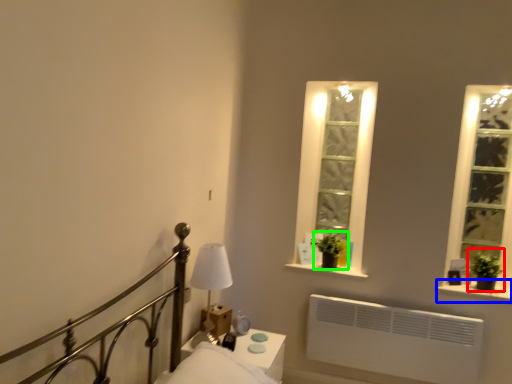
Question: Which is farther away from plant (highlighted by a red box)? window sill (highlighted by a blue box) or plant (highlighted by a green box)?

Choices:
 (A) window sill
 (B) plant

Answer: (B)